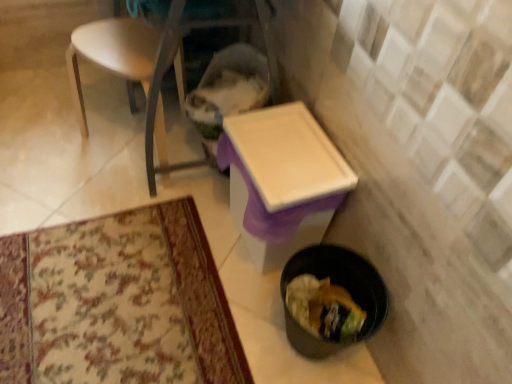
Find the location of `vacant area that is in front of white plastic table at center`. vacant area that is in front of white plastic table at center is located at coordinates (226, 307).